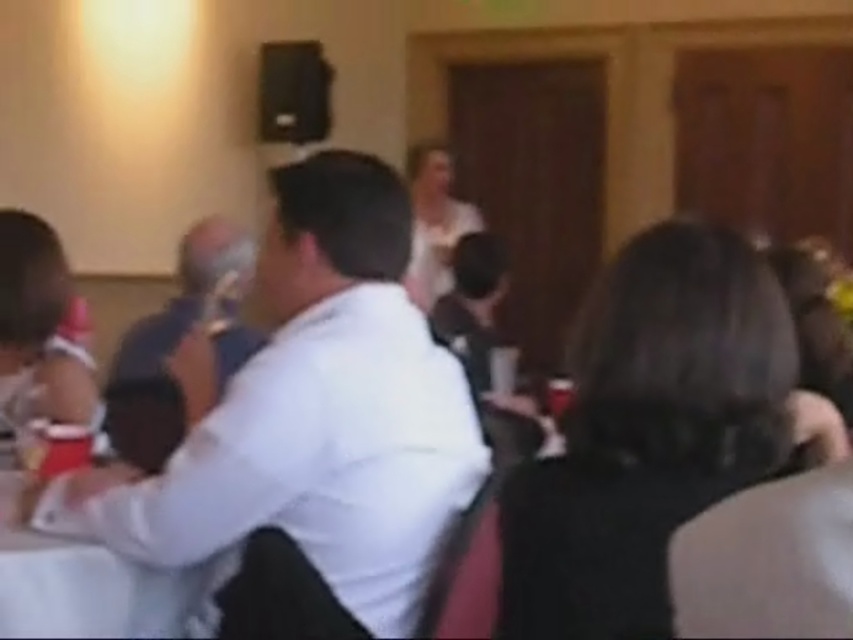
Question: Which point is closer to the camera?

Choices:
 (A) white smooth shirt at center
 (B) white fabric table at center
 (C) white matte dress at center

Answer: (B)

Question: Is black fabric hair at center smaller than white fabric table at center?

Choices:
 (A) yes
 (B) no

Answer: (B)

Question: Where is white smooth shirt at center located in relation to black fabric hair at center in the image?

Choices:
 (A) below
 (B) above

Answer: (A)

Question: Which is nearer to the white smooth shirt at center?

Choices:
 (A) black fabric hair at center
 (B) white matte dress at center
 (C) white fabric table at center

Answer: (C)

Question: Does black fabric hair at center appear over white fabric table at center?

Choices:
 (A) no
 (B) yes

Answer: (B)

Question: Which object is the closest to the white matte dress at center?

Choices:
 (A) black fabric hair at center
 (B) white fabric table at center
 (C) white smooth shirt at center

Answer: (C)